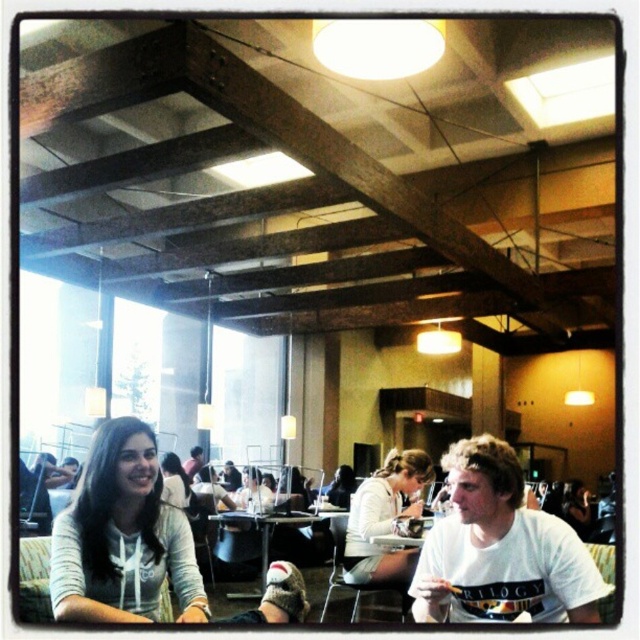
Question: Is white cotton t-shirt at center to the right of wooden table at center from the viewer's perspective?

Choices:
 (A) no
 (B) yes

Answer: (B)

Question: Which point is farther from the camera taking this photo?

Choices:
 (A) (544, 576)
 (B) (189, 481)
 (C) (360, 504)

Answer: (B)

Question: Where is white matte jacket at center located in relation to wooden table at center in the image?

Choices:
 (A) below
 (B) above

Answer: (B)

Question: Which object is farther from the camera taking this photo?

Choices:
 (A) matte black laptop at center
 (B) white cotton t-shirt at center
 (C) light gray hoodie at lower left
 (D) matte white hoodie at lower left

Answer: (A)

Question: Considering the relative positions of white cotton t-shirt at center and matte white hoodie at lower left in the image provided, where is white cotton t-shirt at center located with respect to matte white hoodie at lower left?

Choices:
 (A) right
 (B) left

Answer: (A)

Question: Which object is the farthest from the matte white hoodie at lower left?

Choices:
 (A) white matte jacket at center
 (B) light gray hoodie at lower left
 (C) wooden table at center

Answer: (B)